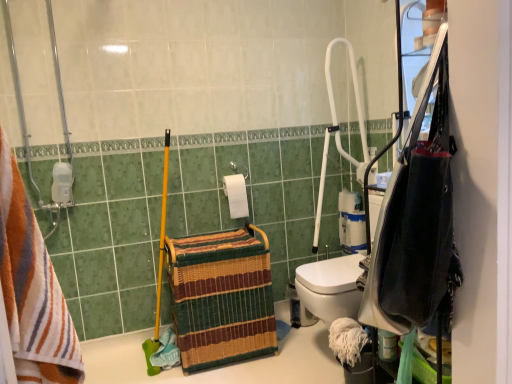
Question: Considering the relative sizes of white matte toilet paper at center, acting as the second toilet paper starting from the back, and white plastic shower at upper right in the image provided, is white matte toilet paper at center, acting as the second toilet paper starting from the back, shorter than white plastic shower at upper right?

Choices:
 (A) no
 (B) yes

Answer: (B)

Question: Considering the relative sizes of white matte toilet paper at center, positioned as the 2th toilet paper in right-to-left order, and white plastic shower at upper right in the image provided, is white matte toilet paper at center, positioned as the 2th toilet paper in right-to-left order, wider than white plastic shower at upper right?

Choices:
 (A) yes
 (B) no

Answer: (B)

Question: Can we say white matte toilet paper at center, the first toilet paper viewed from the front, lies outside white plastic shower at upper right?

Choices:
 (A) no
 (B) yes

Answer: (B)

Question: Considering the relative positions of white matte toilet paper at center, acting as the second toilet paper starting from the back, and white plastic shower at upper right in the image provided, is white matte toilet paper at center, acting as the second toilet paper starting from the back, to the right of white plastic shower at upper right from the viewer's perspective?

Choices:
 (A) no
 (B) yes

Answer: (A)

Question: Does white matte toilet paper at center, acting as the second toilet paper starting from the back, have a larger size compared to white plastic shower at upper right?

Choices:
 (A) yes
 (B) no

Answer: (B)

Question: In terms of width, does striped cotton towel at left look wider or thinner when compared to white matte toilet paper at center, the first toilet paper viewed from the front?

Choices:
 (A) thin
 (B) wide

Answer: (B)

Question: Considering the positions of point (6, 195) and point (224, 188), is point (6, 195) closer or farther from the camera than point (224, 188)?

Choices:
 (A) closer
 (B) farther

Answer: (A)

Question: Based on their positions, is striped cotton towel at left located to the left or right of white matte toilet paper at center, acting as the second toilet paper starting from the back?

Choices:
 (A) right
 (B) left

Answer: (B)

Question: From a real-world perspective, is striped cotton towel at left positioned above or below white matte toilet paper at center, acting as the second toilet paper starting from the back?

Choices:
 (A) below
 (B) above

Answer: (B)

Question: Is black fabric bag at right in front of or behind white matte toilet paper at center, the first toilet paper viewed from the front, in the image?

Choices:
 (A) behind
 (B) front

Answer: (B)

Question: Is black fabric bag at right wider or thinner than white matte toilet paper at center, the first toilet paper viewed from the front?

Choices:
 (A) wide
 (B) thin

Answer: (A)

Question: Based on their sizes in the image, would you say black fabric bag at right is bigger or smaller than white matte toilet paper at center, positioned as the 2th toilet paper in right-to-left order?

Choices:
 (A) small
 (B) big

Answer: (B)

Question: Based on their positions, is black fabric bag at right located to the left or right of white matte toilet paper at center, the first toilet paper viewed from the left?

Choices:
 (A) left
 (B) right

Answer: (B)

Question: In terms of height, does white matte toilet paper at center, the first toilet paper viewed from the front, look taller or shorter compared to woven straw basket at center?

Choices:
 (A) tall
 (B) short

Answer: (B)

Question: From the image's perspective, is white matte toilet paper at center, the first toilet paper viewed from the left, positioned above or below woven straw basket at center?

Choices:
 (A) below
 (B) above

Answer: (B)